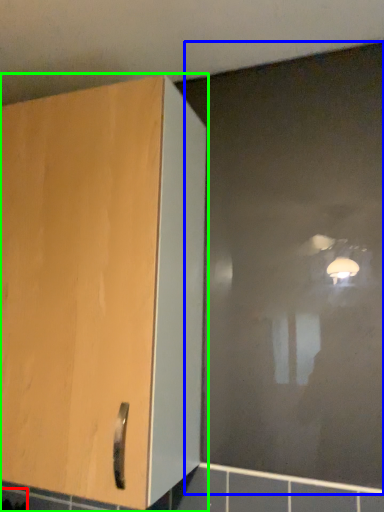
Question: Considering the real-world distances, which object is closest to ceramic tile (highlighted by a red box)? glass door (highlighted by a blue box) or cupboard (highlighted by a green box).

Choices:
 (A) glass door
 (B) cupboard

Answer: (B)